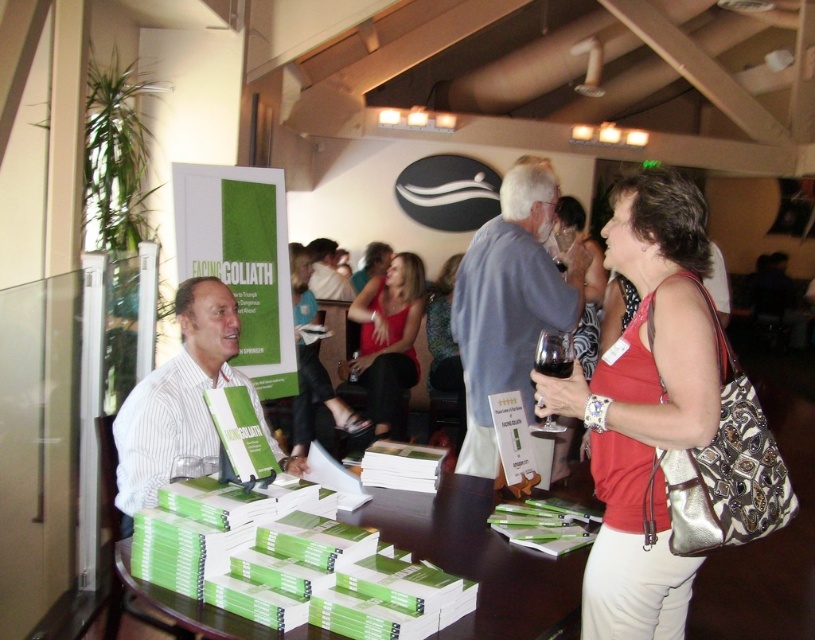
Who is shorter, red fabric tank top at center or matte red tank top at center?

red fabric tank top at center is shorter.

Does red fabric tank top at center come in front of matte red tank top at center?

Yes, red fabric tank top at center is in front of matte red tank top at center.

Who is more forward, (x=657, y=472) or (x=377, y=284)?

Point (x=657, y=472) is in front.

Identify the location of red fabric tank top at center. The width and height of the screenshot is (815, 640). (645, 404).

Does green paper book at center come in front of matte red tank top at center?

That is True.

Does green paper book at center appear on the right side of matte red tank top at center?

Yes, green paper book at center is to the right of matte red tank top at center.

Is point (490, 618) more distant than point (364, 349)?

No, it is in front of (364, 349).

The image size is (815, 640). I want to click on green paper book at center, so click(x=479, y=556).

Who is positioned more to the right, red fabric tank top at center or green paper book at center?

From the viewer's perspective, red fabric tank top at center appears more on the right side.

Does red fabric tank top at center appear under green paper book at center?

Incorrect, red fabric tank top at center is not positioned below green paper book at center.

Is point (711, 372) farther from viewer compared to point (391, 518)?

No, (711, 372) is closer to viewer.

I want to click on red fabric tank top at center, so click(x=645, y=404).